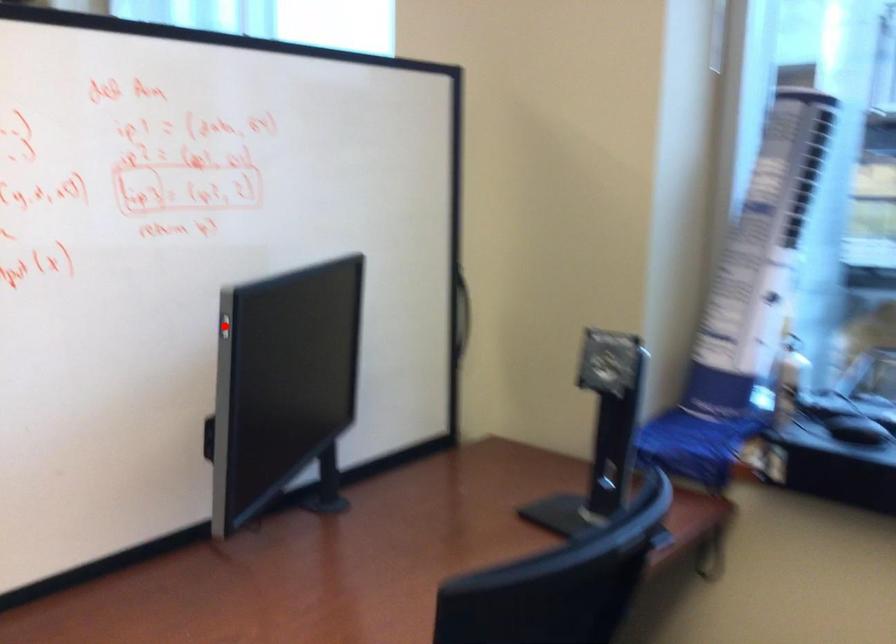
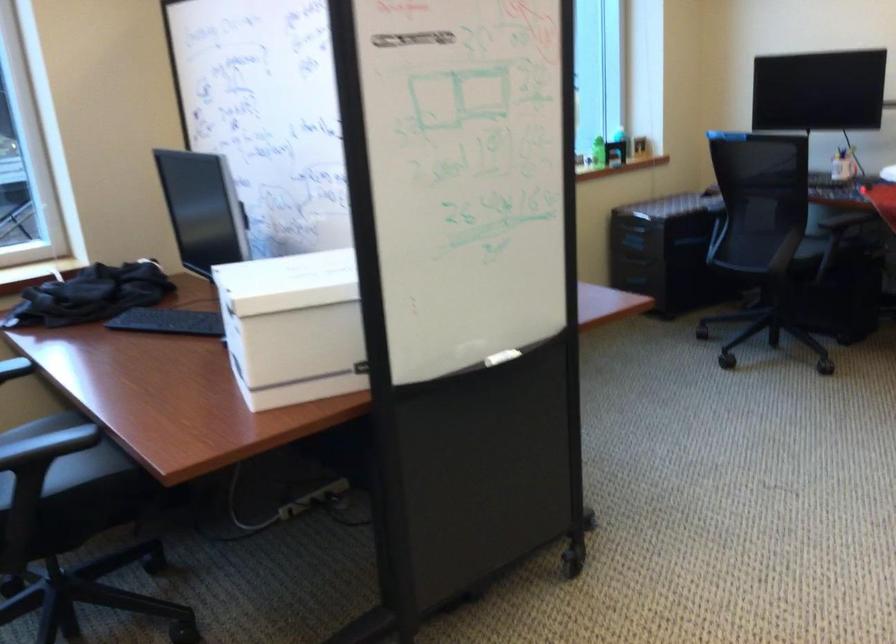
Question: I am providing you with two images of the same scene from different viewpoints. A red point is marked on the first image. Can you still see the location of the red point in image 2?

Choices:
 (A) Yes
 (B) No

Answer: (B)